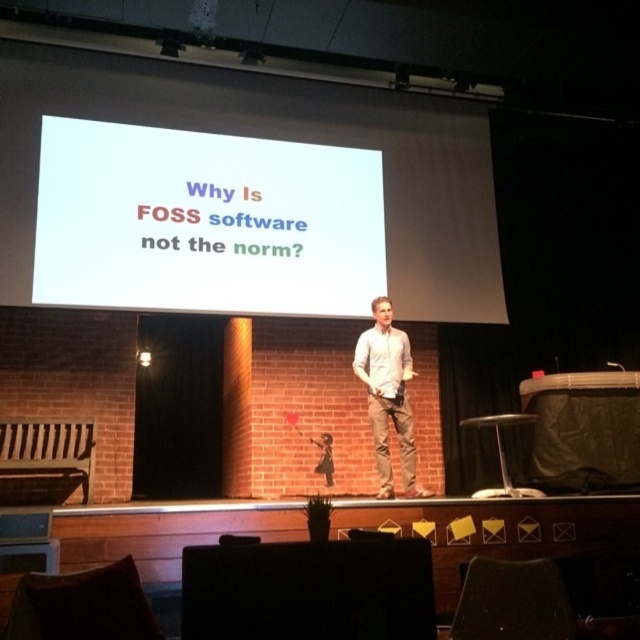
You are an attendee at the presentation. You notice two points marked in the image. The first point is at coordinates point (x=108, y=129) and the second is at point (x=392, y=362). Which point is closer to you as an attendee sitting in the front row?

Point (x=108, y=129) is closer to you because it is further to the viewer than point (x=392, y=362).

You are an event planner setting up a presentation. You need to place a small decorative item at the point with coordinates point (280,148). Based on the scene description, where exactly should this item be placed?

The point (280,148) is on the white matte projection screen at upper center, so the decorative item should be placed on the white matte projection screen at upper center.